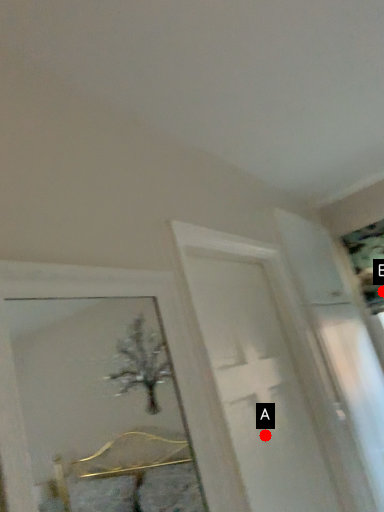
Question: Two points are circled on the image, labeled by A and B beside each circle. Which point is further to the camera?

Choices:
 (A) A is further
 (B) B is further

Answer: (B)